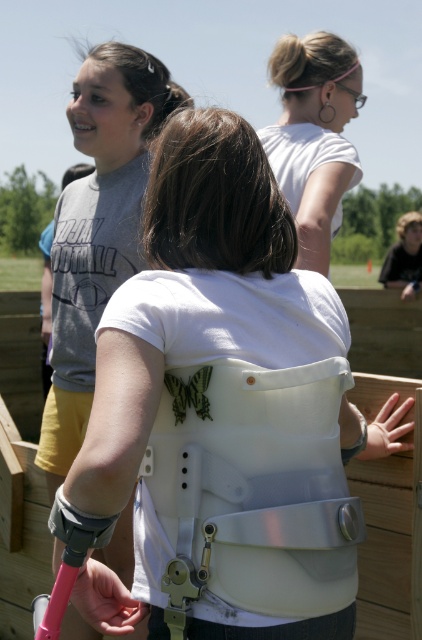
Question: Is the position of white matte brace at center less distant than that of white matte shirt at upper center?

Choices:
 (A) no
 (B) yes

Answer: (A)

Question: Observing the image, what is the correct spatial positioning of white matte brace at center in reference to white matte shirt at upper center?

Choices:
 (A) above
 (B) below

Answer: (B)

Question: Can you confirm if white matte brace at center is positioned to the right of white matte shirt at upper center?

Choices:
 (A) yes
 (B) no

Answer: (B)

Question: Which object is closer to the camera taking this photo?

Choices:
 (A) white matte shirt at upper center
 (B) white matte brace at center

Answer: (A)

Question: Which point is farther from the camera taking this photo?

Choices:
 (A) (306, 157)
 (B) (130, 572)

Answer: (A)